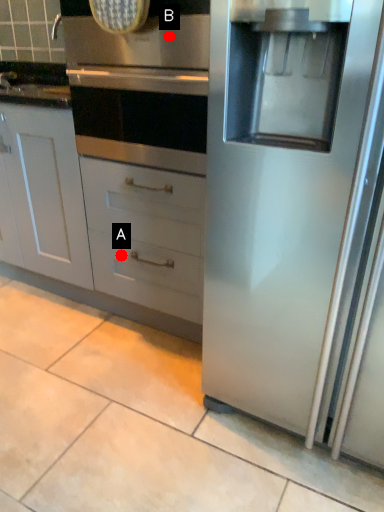
Question: Two points are circled on the image, labeled by A and B beside each circle. Which point is farther to the camera?

Choices:
 (A) A is further
 (B) B is further

Answer: (A)